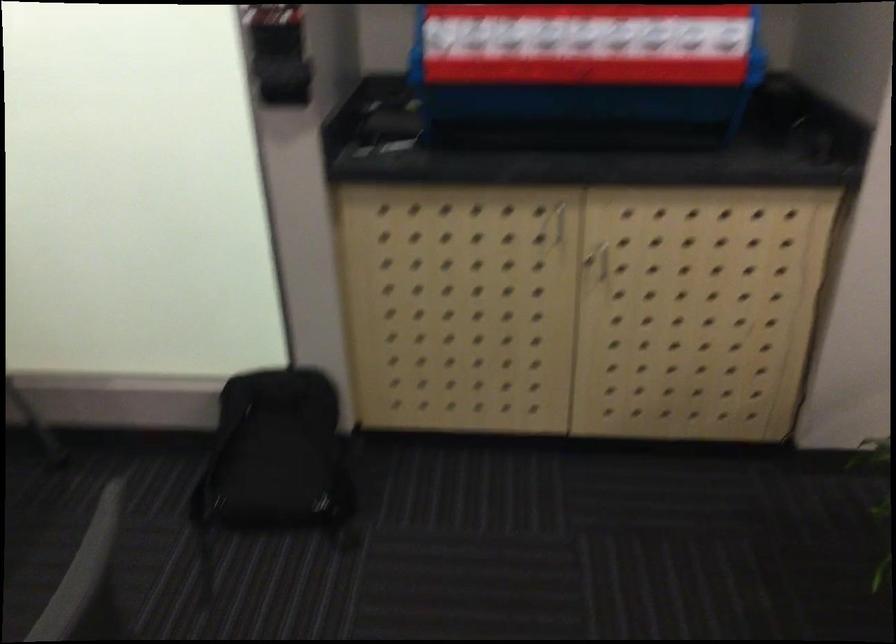
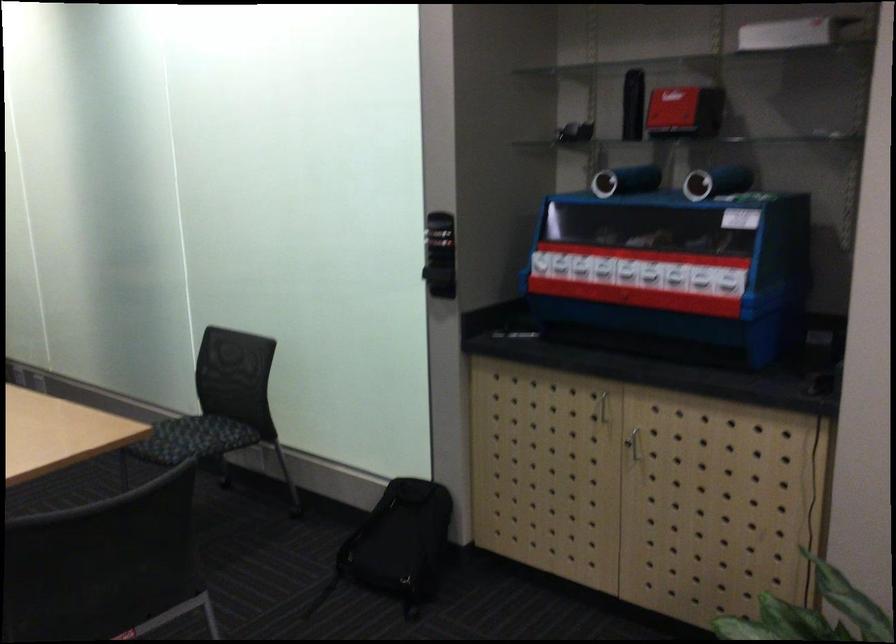
In the second image, find the point that corresponds to (591,261) in the first image.

(633, 442)